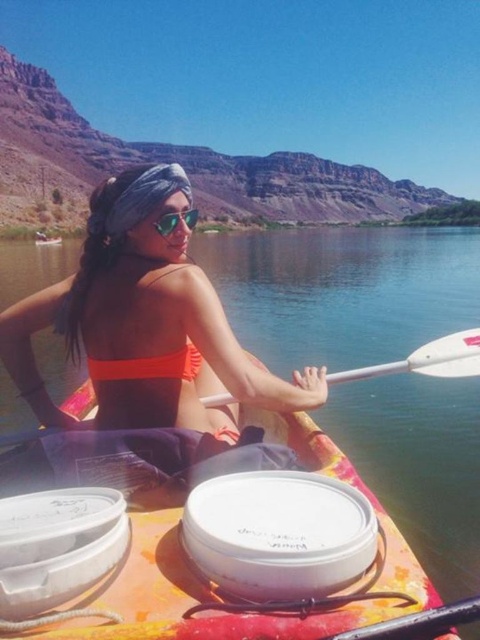
Question: Which point is farther to the camera?

Choices:
 (A) orange fabric boat at center
 (B) green reflective lenses at center

Answer: (A)

Question: Does white plastic paddle at center appear on the right side of matte red bikini top at center?

Choices:
 (A) yes
 (B) no

Answer: (A)

Question: Among these objects, which one is nearest to the camera?

Choices:
 (A) clear water at center
 (B) orange fabric boat at center
 (C) orange bikini top at upper center
 (D) white plastic paddle at center

Answer: (A)

Question: Does orange bikini top at upper center have a greater width compared to green reflective lenses at center?

Choices:
 (A) no
 (B) yes

Answer: (B)

Question: Which object appears farthest from the camera in this image?

Choices:
 (A) white plastic paddle at center
 (B) orange bikini top at upper center
 (C) green reflective lenses at center

Answer: (C)

Question: Where is orange bikini top at upper center located in relation to white plastic paddle at center in the image?

Choices:
 (A) above
 (B) below

Answer: (A)